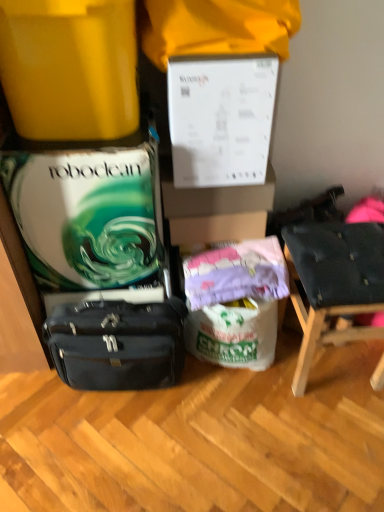
Question: Is dark blue fabric chair at right positioned behind purple fabric at center?

Choices:
 (A) no
 (B) yes

Answer: (A)

Question: Is dark blue fabric chair at right outside of purple fabric at center?

Choices:
 (A) no
 (B) yes

Answer: (B)

Question: Is dark blue fabric chair at right closer to camera compared to purple fabric at center?

Choices:
 (A) yes
 (B) no

Answer: (A)

Question: Is there a large distance between dark blue fabric chair at right and purple fabric at center?

Choices:
 (A) no
 (B) yes

Answer: (A)

Question: Would you say dark blue fabric chair at right contains purple fabric at center?

Choices:
 (A) yes
 (B) no

Answer: (B)

Question: Can you confirm if dark blue fabric chair at right is shorter than purple fabric at center?

Choices:
 (A) no
 (B) yes

Answer: (A)

Question: Is matte yellow container at upper left oriented away from matte black briefcase at lower left?

Choices:
 (A) no
 (B) yes

Answer: (A)

Question: Is matte yellow container at upper left at the right side of matte black briefcase at lower left?

Choices:
 (A) no
 (B) yes

Answer: (A)

Question: Can you confirm if matte yellow container at upper left is taller than matte black briefcase at lower left?

Choices:
 (A) yes
 (B) no

Answer: (B)

Question: From the image's perspective, is matte yellow container at upper left under matte black briefcase at lower left?

Choices:
 (A) yes
 (B) no

Answer: (B)

Question: Considering the relative sizes of matte yellow container at upper left and matte black briefcase at lower left in the image provided, is matte yellow container at upper left bigger than matte black briefcase at lower left?

Choices:
 (A) no
 (B) yes

Answer: (B)

Question: Is matte yellow container at upper left positioned beyond the bounds of matte black briefcase at lower left?

Choices:
 (A) no
 (B) yes

Answer: (B)

Question: Are purple fabric at center and dark blue fabric chair at right beside each other?

Choices:
 (A) yes
 (B) no

Answer: (B)